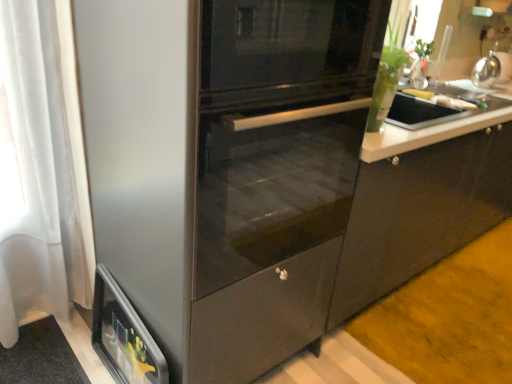
In order to face stainless steel fridge at center, should I rotate leftwards or rightwards?

To align with it, rotate left about 4.139°.

What do you see at coordinates (453, 102) in the screenshot?
I see `white glossy plate at upper right, positioned as the 1th food in front-to-back order` at bounding box center [453, 102].

At what (x,y) coordinates should I click in order to perform the action: click on yellow matte banana at upper right, the 1th food when ordered from back to front. Please return your answer as a coordinate pair (x, y). The image size is (512, 384). Looking at the image, I should click on (419, 93).

Which of these two, metallic silver toaster at lower left or white glossy plate at upper right, positioned as the 1th food in front-to-back order, stands shorter?

white glossy plate at upper right, positioned as the 1th food in front-to-back order, is shorter.

Between metallic silver toaster at lower left and white glossy plate at upper right, positioned as the second food in back-to-front order, which one has larger width?

white glossy plate at upper right, positioned as the second food in back-to-front order, is wider.

Considering the points (117, 352) and (458, 107), which point is behind, point (117, 352) or point (458, 107)?

The point (458, 107) is farther.

From the image's perspective, is metallic silver toaster at lower left above or below white glossy plate at upper right, positioned as the second food in back-to-front order?

metallic silver toaster at lower left is situated lower than white glossy plate at upper right, positioned as the second food in back-to-front order, in the image.

Considering the relative sizes of yellow matte banana at upper right, the 1th food when ordered from back to front, and stainless steel fridge at center in the image provided, is yellow matte banana at upper right, the 1th food when ordered from back to front, thinner than stainless steel fridge at center?

Correct, the width of yellow matte banana at upper right, the 1th food when ordered from back to front, is less than that of stainless steel fridge at center.

Considering the relative sizes of yellow matte banana at upper right, the 1th food when ordered from back to front, and stainless steel fridge at center in the image provided, is yellow matte banana at upper right, the 1th food when ordered from back to front, smaller than stainless steel fridge at center?

Yes.

Is yellow matte banana at upper right, the 1th food when ordered from back to front, not near stainless steel fridge at center?

Indeed, yellow matte banana at upper right, the 1th food when ordered from back to front, is not near stainless steel fridge at center.

Is yellow matte banana at upper right, which is counted as the second food, starting from the front, positioned with its back to stainless steel fridge at center?

That's not correct — yellow matte banana at upper right, which is counted as the second food, starting from the front, is not looking away from stainless steel fridge at center.

Are yellow matte banana at upper right, the 1th food when ordered from back to front, and metallic silver toaster at lower left beside each other?

yellow matte banana at upper right, the 1th food when ordered from back to front, and metallic silver toaster at lower left are not in contact.

Is yellow matte banana at upper right, which is counted as the second food, starting from the front, wider than metallic silver toaster at lower left?

Indeed, yellow matte banana at upper right, which is counted as the second food, starting from the front, has a greater width compared to metallic silver toaster at lower left.

Is metallic silver toaster at lower left surrounded by yellow matte banana at upper right, which is counted as the second food, starting from the front?

No, metallic silver toaster at lower left is not a part of yellow matte banana at upper right, which is counted as the second food, starting from the front.

From a real-world perspective, is yellow matte banana at upper right, the 1th food when ordered from back to front, physically above metallic silver toaster at lower left?

Indeed, from a real-world perspective, yellow matte banana at upper right, the 1th food when ordered from back to front, stands above metallic silver toaster at lower left.

Between satin silver kettle at upper right and stainless steel fridge at center, which one has more height?

stainless steel fridge at center.

Locate an element on the screen. This screenshot has width=512, height=384. fridge to the left of satin silver kettle at upper right is located at coordinates (225, 166).

Could you tell me if satin silver kettle at upper right is turned towards stainless steel fridge at center?

No, satin silver kettle at upper right is not facing towards stainless steel fridge at center.

Is satin silver kettle at upper right positioned far away from stainless steel fridge at center?

Yes, satin silver kettle at upper right and stainless steel fridge at center are located far from each other.

Is the position of metallic silver toaster at lower left more distant than that of yellow matte banana at upper right, which is counted as the second food, starting from the front?

No, it is in front of yellow matte banana at upper right, which is counted as the second food, starting from the front.

From the image's perspective, which object appears higher, metallic silver toaster at lower left or yellow matte banana at upper right, the 1th food when ordered from back to front?

yellow matte banana at upper right, the 1th food when ordered from back to front, from the image's perspective.

I want to click on the 1st food above the metallic silver toaster at lower left (from a real-world perspective), so click(419, 93).

How many degrees apart are the facing directions of stainless steel fridge at center and yellow matte banana at upper right, the 1th food when ordered from back to front?

The facing directions of stainless steel fridge at center and yellow matte banana at upper right, the 1th food when ordered from back to front, are 7.14 degrees apart.

Considering the points (146, 304) and (429, 97), which point is behind, point (146, 304) or point (429, 97)?

The point (429, 97) is more distant.

In the scene shown: Is stainless steel fridge at center not close to yellow matte banana at upper right, which is counted as the second food, starting from the front?

Absolutely, stainless steel fridge at center is distant from yellow matte banana at upper right, which is counted as the second food, starting from the front.

From a real-world perspective, is stainless steel fridge at center physically located above or below yellow matte banana at upper right, the 1th food when ordered from back to front?

stainless steel fridge at center is situated lower than yellow matte banana at upper right, the 1th food when ordered from back to front, in the real world.

How many degrees apart are the facing directions of white glossy plate at upper right, positioned as the second food in back-to-front order, and metallic silver toaster at lower left?

white glossy plate at upper right, positioned as the second food in back-to-front order, and metallic silver toaster at lower left are facing 89.1 degrees away from each other.

How much distance is there between white glossy plate at upper right, positioned as the second food in back-to-front order, and metallic silver toaster at lower left?

A distance of 1.68 meters exists between white glossy plate at upper right, positioned as the second food in back-to-front order, and metallic silver toaster at lower left.

Is white glossy plate at upper right, positioned as the second food in back-to-front order, beside metallic silver toaster at lower left?

white glossy plate at upper right, positioned as the second food in back-to-front order, and metallic silver toaster at lower left are not in contact.

Can you confirm if white glossy plate at upper right, positioned as the 1th food in front-to-back order, is thinner than metallic silver toaster at lower left?

No.

I want to click on home appliance below the white glossy plate at upper right, positioned as the second food in back-to-front order (from a real-world perspective), so click(123, 336).

The width and height of the screenshot is (512, 384). I want to click on fridge in front of the yellow matte banana at upper right, which is counted as the second food, starting from the front, so click(225, 166).

Estimate the real-world distances between objects in this image. Which object is closer to yellow matte banana at upper right, the 1th food when ordered from back to front, satin silver kettle at upper right or white glossy plate at upper right, positioned as the second food in back-to-front order?

white glossy plate at upper right, positioned as the second food in back-to-front order, is closer to yellow matte banana at upper right, the 1th food when ordered from back to front.

Based on their spatial positions, is metallic silver toaster at lower left or satin silver kettle at upper right closer to yellow matte banana at upper right, the 1th food when ordered from back to front?

satin silver kettle at upper right is positioned closer to the anchor yellow matte banana at upper right, the 1th food when ordered from back to front.

Which object lies nearer to the anchor point metallic silver toaster at lower left, yellow matte banana at upper right, which is counted as the second food, starting from the front, or white glossy plate at upper right, positioned as the 1th food in front-to-back order?

white glossy plate at upper right, positioned as the 1th food in front-to-back order.

Based on their spatial positions, is metallic silver toaster at lower left or yellow matte banana at upper right, the 1th food when ordered from back to front, closer to stainless steel fridge at center?

metallic silver toaster at lower left is closer to stainless steel fridge at center.

When comparing their distances from yellow matte banana at upper right, which is counted as the second food, starting from the front, does metallic silver toaster at lower left or white glossy plate at upper right, positioned as the second food in back-to-front order, seem closer?

Based on the image, white glossy plate at upper right, positioned as the second food in back-to-front order, appears to be nearer to yellow matte banana at upper right, which is counted as the second food, starting from the front.

Which object lies nearer to the anchor point stainless steel fridge at center, satin silver kettle at upper right or yellow matte banana at upper right, the 1th food when ordered from back to front?

The object closer to stainless steel fridge at center is yellow matte banana at upper right, the 1th food when ordered from back to front.

When comparing their distances from metallic silver toaster at lower left, does yellow matte banana at upper right, the 1th food when ordered from back to front, or stainless steel fridge at center seem closer?

stainless steel fridge at center.

Considering their positions, is white glossy plate at upper right, positioned as the 1th food in front-to-back order, positioned further to satin silver kettle at upper right than yellow matte banana at upper right, the 1th food when ordered from back to front?

Among the two, white glossy plate at upper right, positioned as the 1th food in front-to-back order, is located further to satin silver kettle at upper right.

Where is `home appliance between stainless steel fridge at center and yellow matte banana at upper right, which is counted as the second food, starting from the front, from front to back`? This screenshot has height=384, width=512. home appliance between stainless steel fridge at center and yellow matte banana at upper right, which is counted as the second food, starting from the front, from front to back is located at coordinates (123, 336).

Where is `food between stainless steel fridge at center and yellow matte banana at upper right, which is counted as the second food, starting from the front, from front to back`? food between stainless steel fridge at center and yellow matte banana at upper right, which is counted as the second food, starting from the front, from front to back is located at coordinates (453, 102).

This screenshot has height=384, width=512. Identify the location of fridge located between metallic silver toaster at lower left and white glossy plate at upper right, positioned as the second food in back-to-front order, in the left-right direction. (225, 166).

I want to click on food between yellow matte banana at upper right, the 1th food when ordered from back to front, and satin silver kettle at upper right, in the horizontal direction, so click(x=453, y=102).